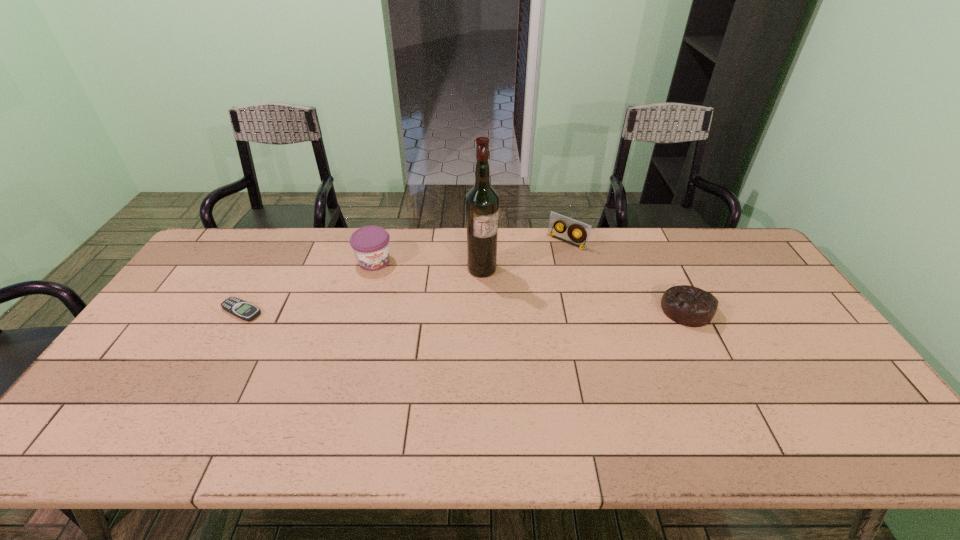
Image resolution: width=960 pixels, height=540 pixels. In order to click on empty space between the wine bottle and the fourth object from left to right in this screenshot , I will do `click(524, 255)`.

This screenshot has height=540, width=960. Find the location of `unoccupied position between the leftmost object and the rightmost object`. unoccupied position between the leftmost object and the rightmost object is located at coordinates (464, 310).

What are the coordinates of `vacant space that is in between the shortest object and the rightmost object` in the screenshot? It's located at (464, 310).

The image size is (960, 540). Find the location of `free space between the third object from left to right and the shortest object`. free space between the third object from left to right and the shortest object is located at coordinates (362, 290).

Where is `free space between the wine bottle and the second object from right to left`? free space between the wine bottle and the second object from right to left is located at coordinates (524, 255).

Find the location of a particular element. free spot between the tallest object and the rightmost object is located at coordinates (584, 289).

I want to click on free space that is in between the fourth object from left to right and the third object from right to left, so tap(524, 255).

Locate an element on the screen. free area in between the shortest object and the wine bottle is located at coordinates (362, 290).

This screenshot has height=540, width=960. What are the coordinates of `object that can be found as the fourth closest to the second object from left to right` in the screenshot? It's located at tap(693, 307).

You are a GUI agent. You are given a task and a screenshot of the screen. Output one action in this format:
    pyautogui.click(x=<x>, y=<y>)
    Task: Click on the closest object relative to the videotape
    The width and height of the screenshot is (960, 540).
    Given the screenshot: What is the action you would take?
    pyautogui.click(x=482, y=202)